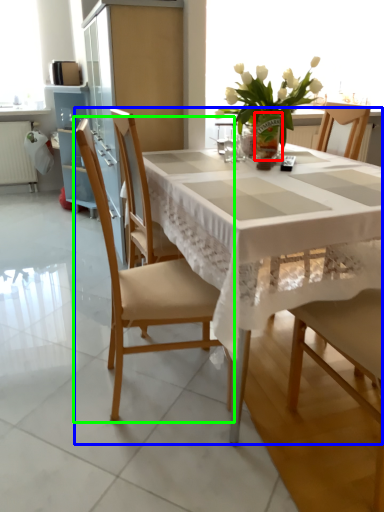
Question: Which object is positioned closest to vase (highlighted by a red box)? Select from kitchen & dining room table (highlighted by a blue box) and chair (highlighted by a green box).

Choices:
 (A) kitchen & dining room table
 (B) chair

Answer: (A)